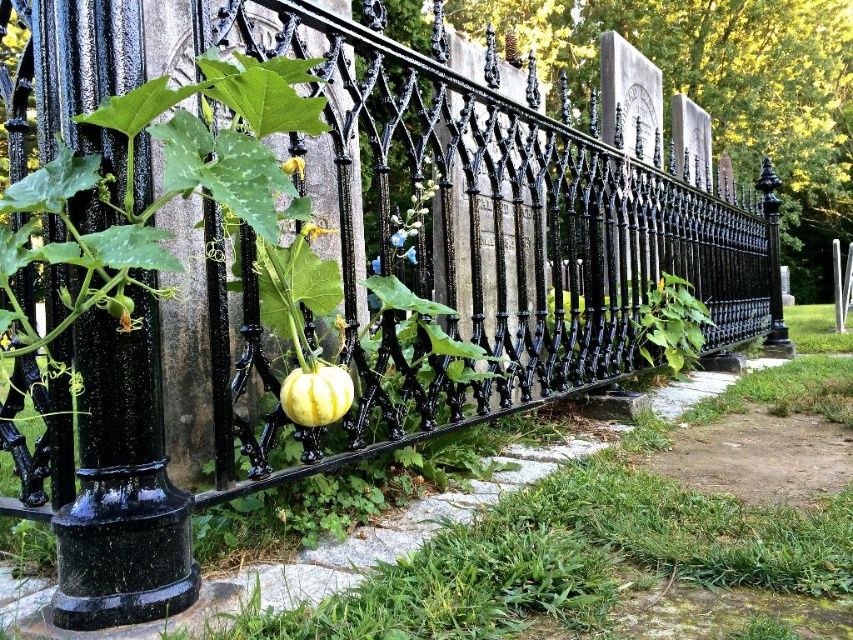
Between point (329, 364) and point (323, 234), which one is positioned behind?

The point (323, 234) is behind.

Who is lower down, yellow striped pumpkin at center or smooth yellow flower at center?

yellow striped pumpkin at center is lower down.

Is point (323, 376) positioned behind point (309, 224)?

That is False.

This screenshot has width=853, height=640. What are the coordinates of `yellow striped pumpkin at center` in the screenshot? It's located at (316, 394).

Does yellow striped pumpkin at center have a lesser height compared to yellow matte flower at center?

In fact, yellow striped pumpkin at center may be taller than yellow matte flower at center.

Who is more forward, (322, 376) or (293, 172)?

Point (322, 376) is more forward.

Find the location of a particular element. The image size is (853, 640). yellow striped pumpkin at center is located at coordinates (316, 394).

Does smooth yellow flower at center lie behind yellow matte flower at center?

Yes, smooth yellow flower at center is further from the viewer.

Which is behind, point (306, 225) or point (288, 170)?

The point (306, 225) is behind.

Which is in front, point (303, 232) or point (293, 157)?

Point (293, 157)

Where is `smooth yellow flower at center`? smooth yellow flower at center is located at coordinates (312, 230).